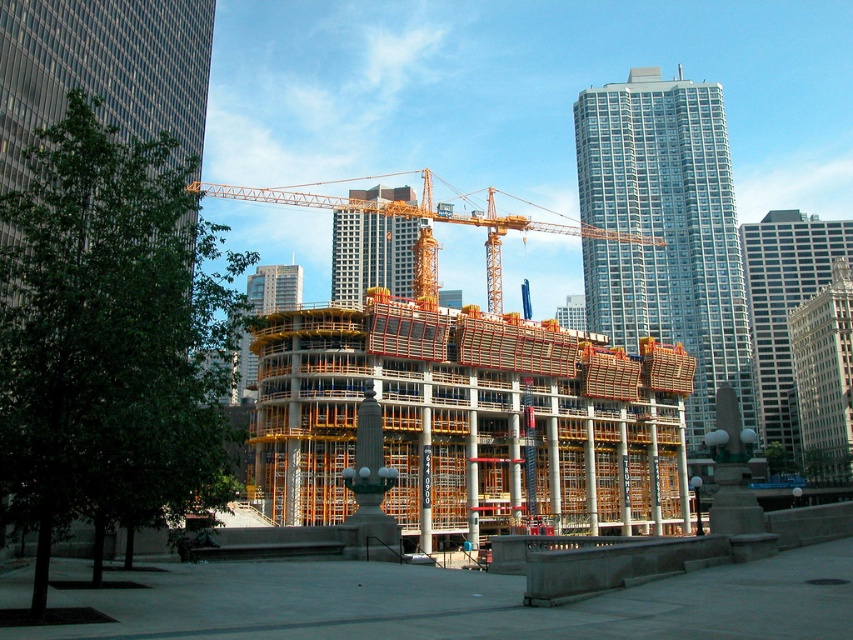
You are a drone operator tasked with capturing aerial footage of the white glass skyscraper at center. Your drone has a maximum flight range of 50 meters from its starting position. If you position yourself at the coordinates point A, which is at point A at coordinates point A at point A at coordinates point A at coordinates point A at coordinates point A at coordinates point A at coordinates point A at coordinates point A at coordinates point A at coordinates point A at coordinates point A at coordinates 0

The white glass skyscraper at center is located at point (784, 307). Since the drone can fly up to 50 meters, you need to calculate the distance between point A and the skyscraper. If the distance is within 50 meters, it can be done. However, without knowing point A coordinates, it is impossible to determine. Please provide point A coordinates to proceed.

Consider the image. You are a drone operator tasked with delivering a package to the gray glass skyscraper at center. The drone has a maximum flight range of 130 meters. Based on the scene, can the drone safely reach the skyscraper?

The gray glass skyscraper at center is 129.31 meters away from camera. Since the drone has a maximum flight range of 130 meters, it can safely reach the skyscraper as the distance is within its operational limit.

You are an architect observing the construction site. You notice the glassy steel skyscraper at upper right and the yellow scaffolding at center. Which object appears larger in the image?

The yellow scaffolding at center appears larger than the glassy steel skyscraper at upper right.